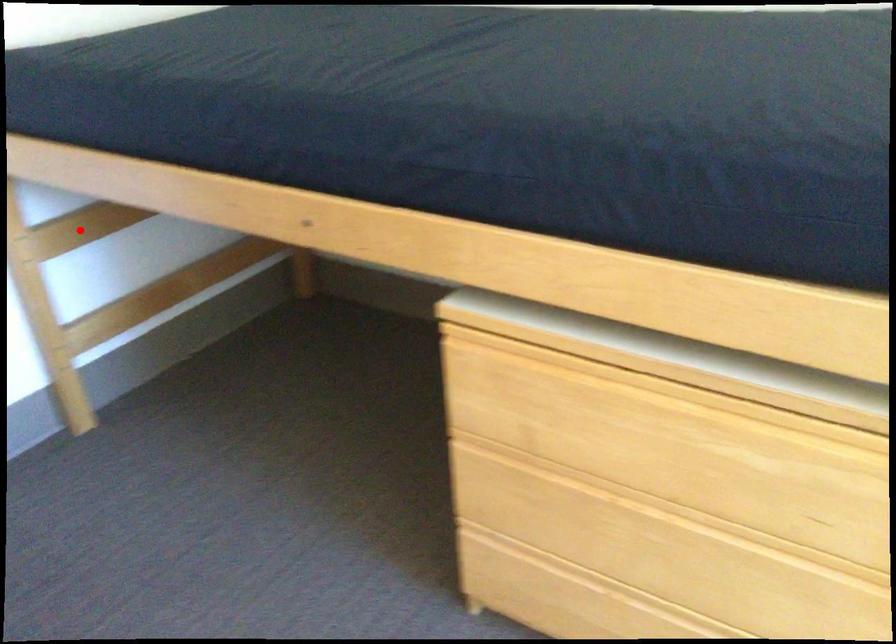
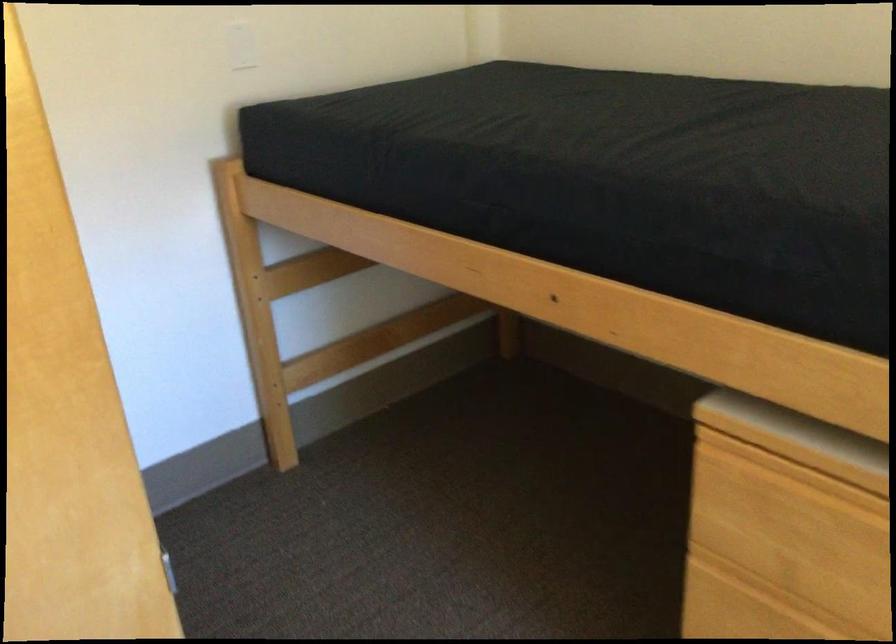
Question: I am providing you with two images of the same scene from different viewpoints. A red point is marked on the first image. At the location where the point appears in image 1, is it still visible in image 2?

Choices:
 (A) Yes
 (B) No

Answer: (A)